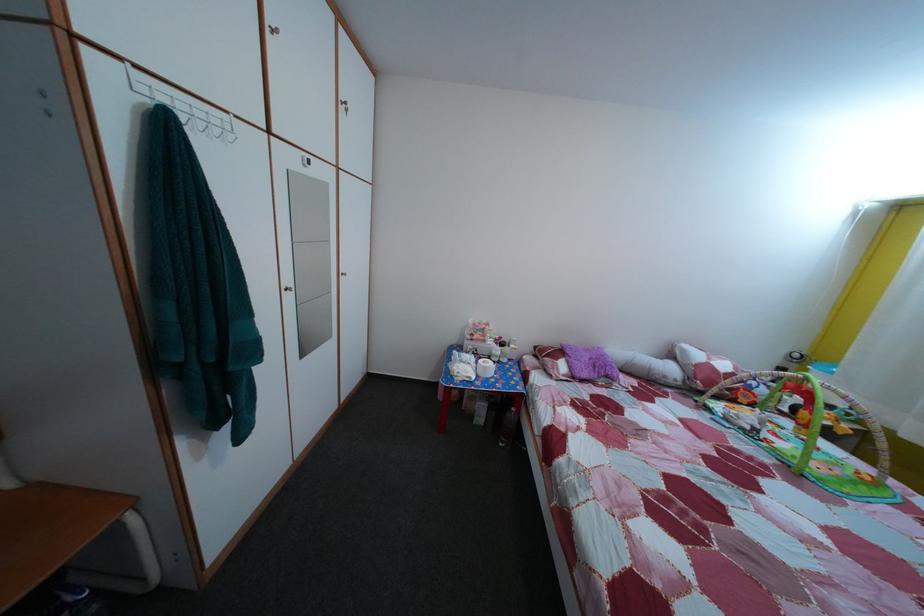
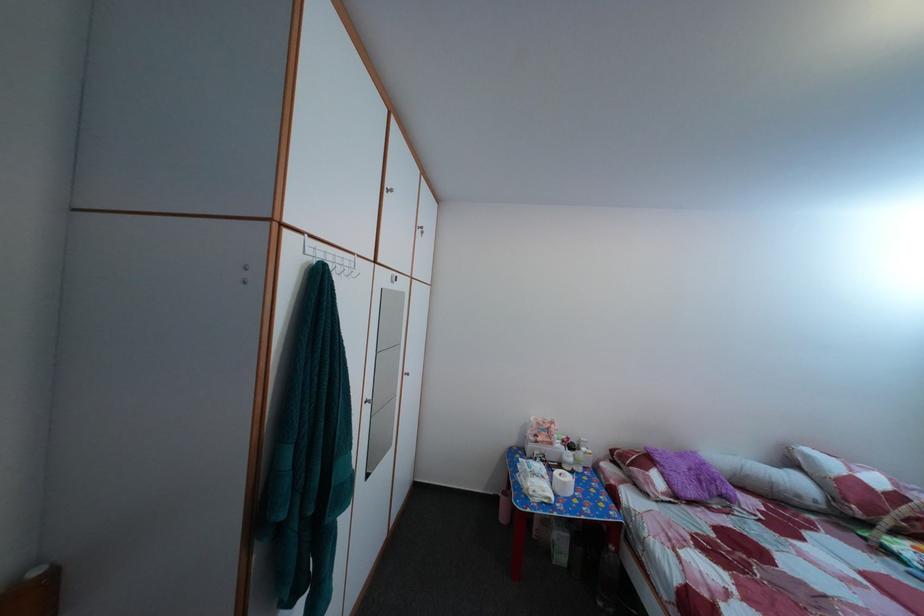
Locate, in the second image, the point that corresponds to point (276, 37) in the first image.

(395, 198)